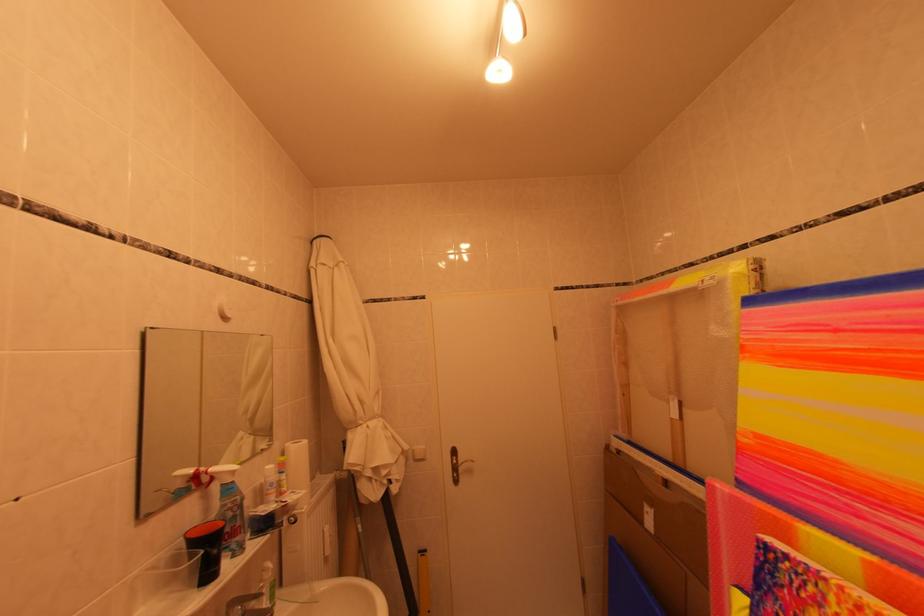
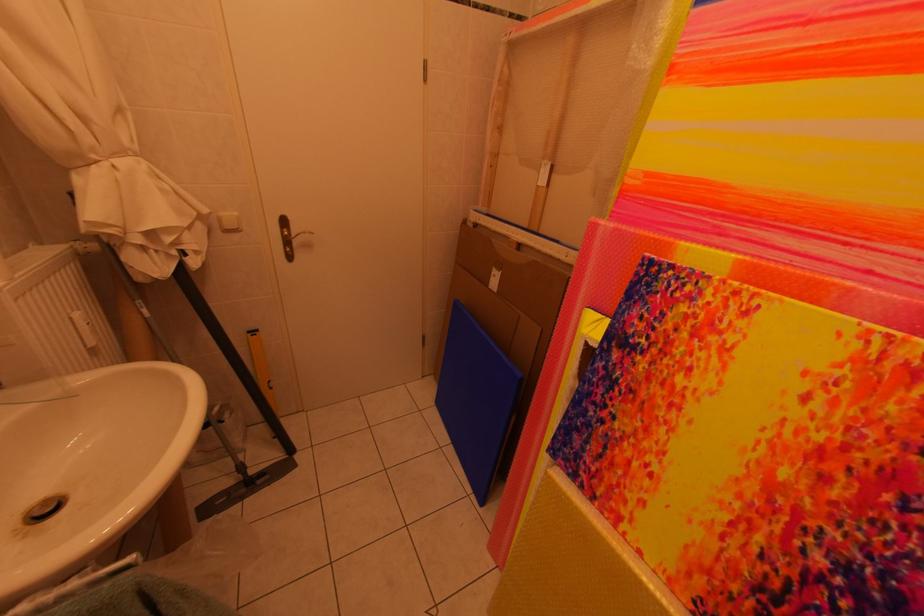
The images are taken continuously from a first-person perspective. In which direction is your viewpoint rotating?

The rotation direction of the camera is right-down.